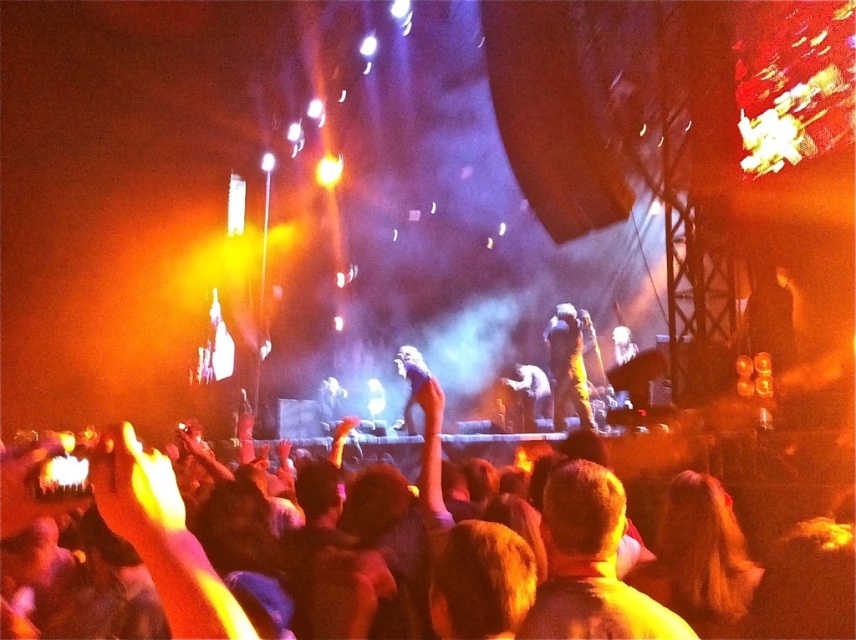
You are standing at point [556,388] and want to take a photo of the stage. The camera you have can focus on subjects within 10 meters. Will you be able to capture the stage clearly?

The distance between you at point [556,388] and the camera is 12.05 meters, which is beyond the camera focus range of 10 meters. Therefore, you won not be able to capture the stage clearly.

You are a photographer at the concert and want to capture both the matte gold jacket at center and the shiny silver microphone at center in a single shot. Which object should you focus on first to ensure both are in frame?

You should focus on the shiny silver microphone at center first since the matte gold jacket at center is positioned to its right, ensuring both are within the frame when centered on the microphone.

You are a photographer at the concert and want to capture both the matte gold jacket at center and the shiny silver microphone at center in a single frame. Based on their sizes, which object will appear bigger in your photo?

The matte gold jacket at center will appear bigger in the photo because it has a larger size compared to the shiny silver microphone at center.